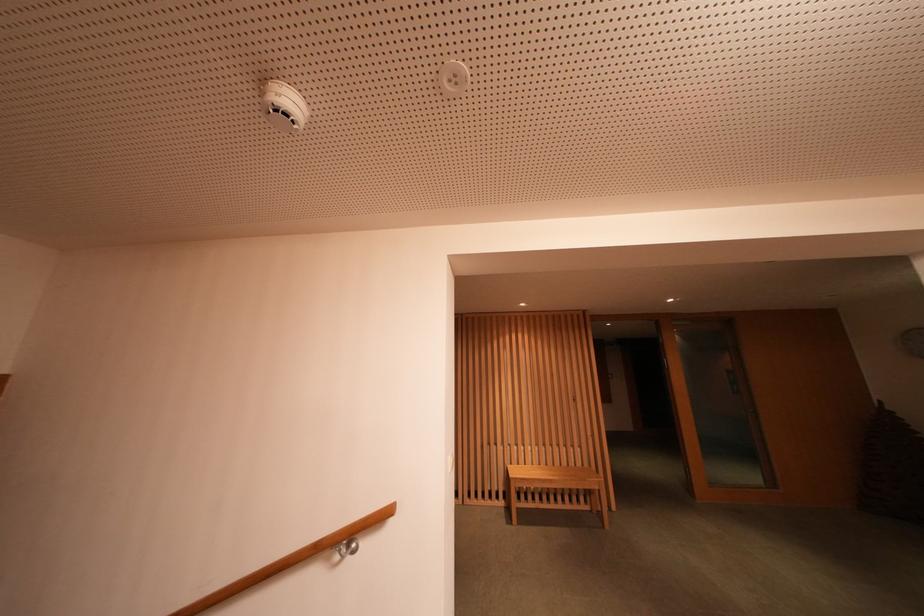
What do you see at coordinates (290, 560) in the screenshot? I see `a wooden handrail` at bounding box center [290, 560].